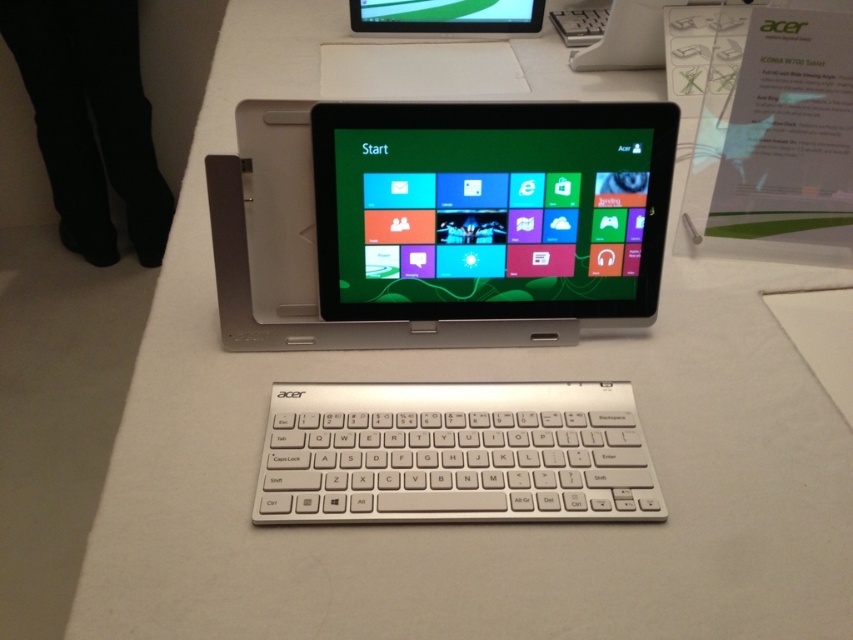
Question: Is silver metallic tablet at center thinner than white matte keyboard at center?

Choices:
 (A) no
 (B) yes

Answer: (A)

Question: Is silver metallic tablet at center closer to camera compared to matte plastic tablet at center?

Choices:
 (A) yes
 (B) no

Answer: (A)

Question: Estimate the real-world distances between objects in this image. Which object is farther from the matte plastic tablet at center?

Choices:
 (A) silver metallic tablet at center
 (B) white matte keyboard at center

Answer: (B)

Question: Considering the relative positions of silver metallic tablet at center and matte plastic tablet at center in the image provided, where is silver metallic tablet at center located with respect to matte plastic tablet at center?

Choices:
 (A) left
 (B) right

Answer: (A)

Question: Considering the real-world distances, which object is farthest from the white matte keyboard at center?

Choices:
 (A) silver metallic tablet at center
 (B) matte plastic tablet at center

Answer: (B)

Question: Which object appears farthest from the camera in this image?

Choices:
 (A) matte plastic tablet at center
 (B) white matte keyboard at center
 (C) silver metallic tablet at center

Answer: (A)